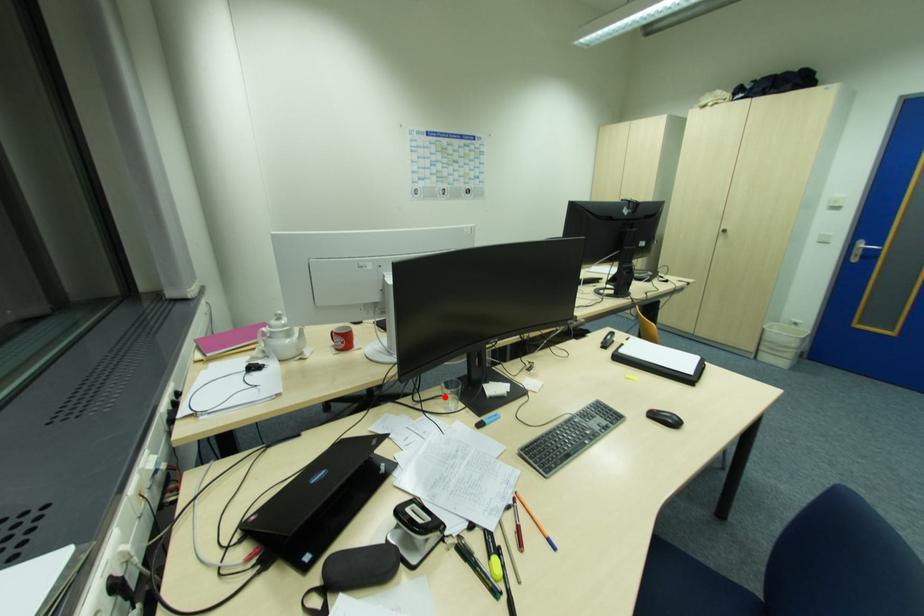
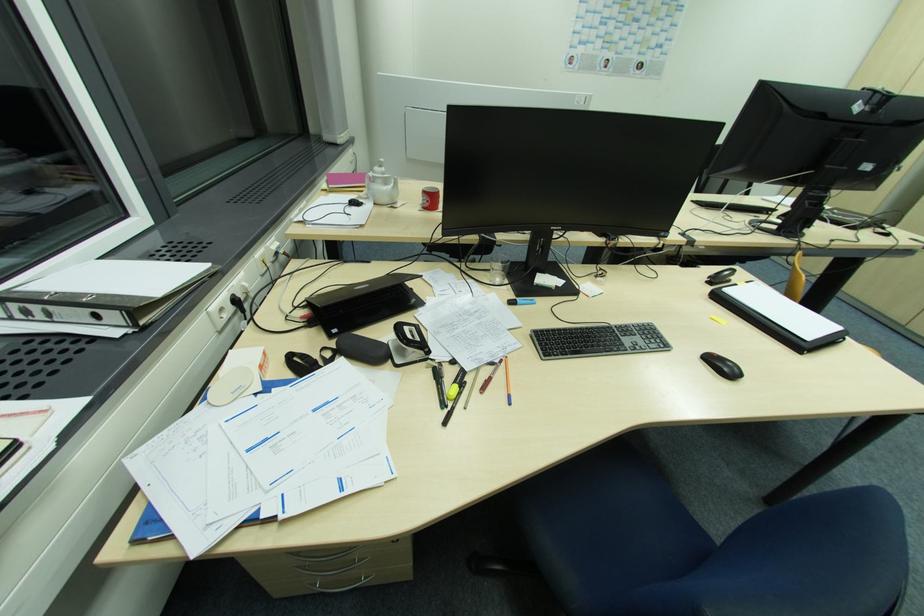
In the second image, find the point that corresponds to the highlighted location in the first image.

(493, 270)